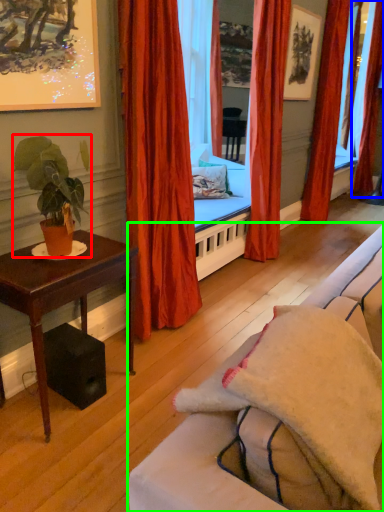
Question: Based on their relative distances, which object is farther from houseplant (highlighted by a red box)? Choose from curtain (highlighted by a blue box) and studio couch (highlighted by a green box).

Choices:
 (A) curtain
 (B) studio couch

Answer: (A)